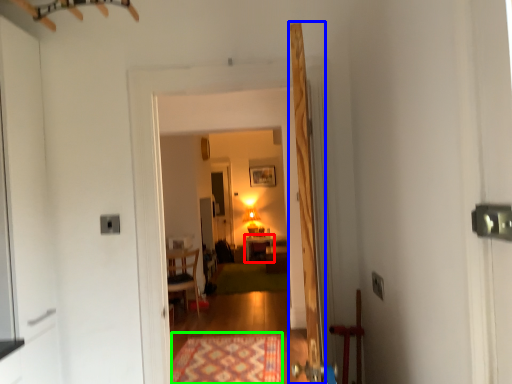
Question: Considering the real-world distances, which object is closest to table (highlighted by a red box)? door (highlighted by a blue box) or mat (highlighted by a green box).

Choices:
 (A) door
 (B) mat

Answer: (B)